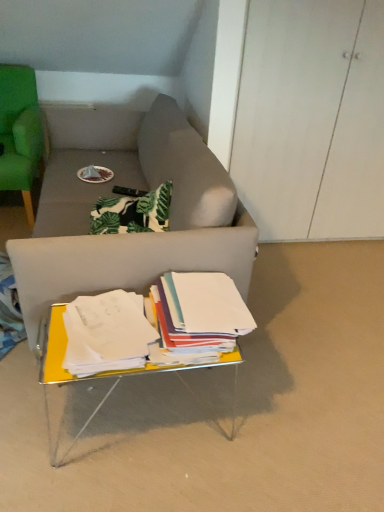
Question: Can you confirm if green fabric chair at left is taller than yellow metallic table at lower center?

Choices:
 (A) yes
 (B) no

Answer: (A)

Question: From the image's perspective, is green fabric chair at left on top of yellow metallic table at lower center?

Choices:
 (A) yes
 (B) no

Answer: (A)

Question: From the image's perspective, is green fabric chair at left below yellow metallic table at lower center?

Choices:
 (A) yes
 (B) no

Answer: (B)

Question: Can you confirm if green fabric chair at left is positioned to the left of yellow metallic table at lower center?

Choices:
 (A) no
 (B) yes

Answer: (B)

Question: Is yellow metallic table at lower center inside green fabric chair at left?

Choices:
 (A) yes
 (B) no

Answer: (B)

Question: Choose the correct answer: Is white paper at center, the second paperback book in the left-to-right sequence, inside white paper at center, placed as the 2th paperback book when sorted from right to left, or outside it?

Choices:
 (A) outside
 (B) inside

Answer: (A)

Question: Is white paper at center, the second paperback book in the left-to-right sequence, wider or thinner than white paper at center, placed as the 2th paperback book when sorted from right to left?

Choices:
 (A) thin
 (B) wide

Answer: (B)

Question: Is white paper at center, marked as the first paperback book in a right-to-left arrangement, in front of or behind white paper at center, placed as the 1th paperback book when sorted from left to right, in the image?

Choices:
 (A) behind
 (B) front

Answer: (A)

Question: From a real-world perspective, relative to white paper at center, placed as the 2th paperback book when sorted from right to left, is white paper at center, the second paperback book in the left-to-right sequence, vertically above or below?

Choices:
 (A) below
 (B) above

Answer: (B)

Question: Considering the positions of yellow metallic table at lower center and white paper at center, marked as the first paperback book in a right-to-left arrangement, in the image, is yellow metallic table at lower center taller or shorter than white paper at center, marked as the first paperback book in a right-to-left arrangement,?

Choices:
 (A) tall
 (B) short

Answer: (A)

Question: From the image's perspective, is yellow metallic table at lower center positioned above or below white paper at center, marked as the first paperback book in a right-to-left arrangement?

Choices:
 (A) below
 (B) above

Answer: (A)

Question: Is yellow metallic table at lower center inside or outside of white paper at center, marked as the first paperback book in a right-to-left arrangement?

Choices:
 (A) inside
 (B) outside

Answer: (B)

Question: Considering the positions of point (152, 310) and point (190, 308), is point (152, 310) closer or farther from the camera than point (190, 308)?

Choices:
 (A) closer
 (B) farther

Answer: (B)

Question: In terms of width, does yellow metallic table at lower center look wider or thinner when compared to white paper at center, placed as the 2th paperback book when sorted from right to left?

Choices:
 (A) wide
 (B) thin

Answer: (A)

Question: From a real-world perspective, is yellow metallic table at lower center positioned above or below white paper at center, placed as the 1th paperback book when sorted from left to right?

Choices:
 (A) below
 (B) above

Answer: (A)